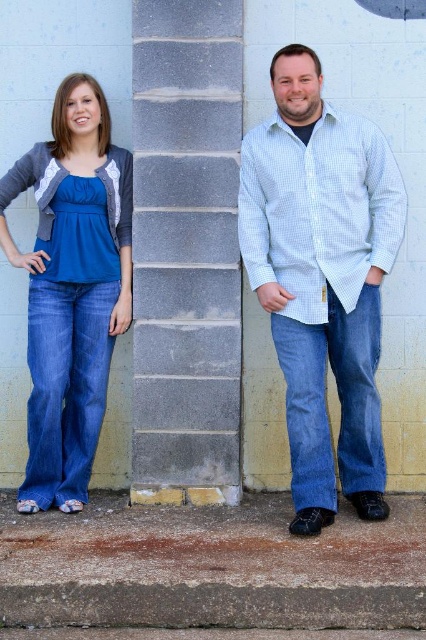
Question: Which object appears closest to the camera in this image?

Choices:
 (A) blue jeans at right
 (B) matte blue jeans at left
 (C) gray concrete pillar at center
 (D) blue denim jeans at center

Answer: (A)

Question: Which of the following is the farthest from the observer?

Choices:
 (A) (339, 292)
 (B) (224, 192)

Answer: (B)

Question: Is gray concrete pillar at center behind blue denim jeans at center?

Choices:
 (A) yes
 (B) no

Answer: (A)

Question: Is gray concrete pillar at center above blue denim jeans at center?

Choices:
 (A) yes
 (B) no

Answer: (A)

Question: Which of the following is the farthest from the observer?

Choices:
 (A) matte blue jeans at left
 (B) blue denim jeans at center

Answer: (A)

Question: Is blue jeans at right smaller than matte blue jeans at left?

Choices:
 (A) no
 (B) yes

Answer: (A)